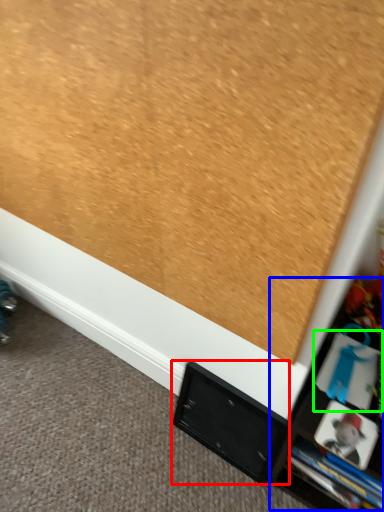
Question: Which object is positioned closest to cabinet (highlighted by a red box)? Select from tv cabinet (highlighted by a blue box) and book (highlighted by a green box).

Choices:
 (A) tv cabinet
 (B) book

Answer: (A)